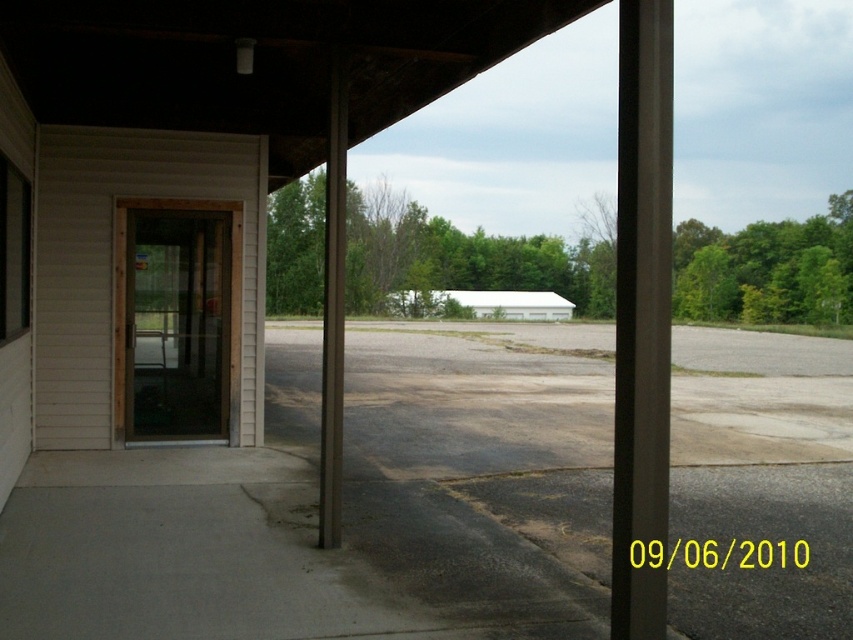
Question: From the image, what is the correct spatial relationship of black smooth pole at center in relation to brown wood pillar at center?

Choices:
 (A) above
 (B) below

Answer: (A)

Question: Is the position of black smooth pole at center less distant than that of brown wood pillar at center?

Choices:
 (A) yes
 (B) no

Answer: (A)

Question: Can you confirm if black smooth pole at center is bigger than brown wood pillar at center?

Choices:
 (A) yes
 (B) no

Answer: (A)

Question: Which object is farther from the camera taking this photo?

Choices:
 (A) black smooth pole at center
 (B) brown wood pillar at center

Answer: (B)